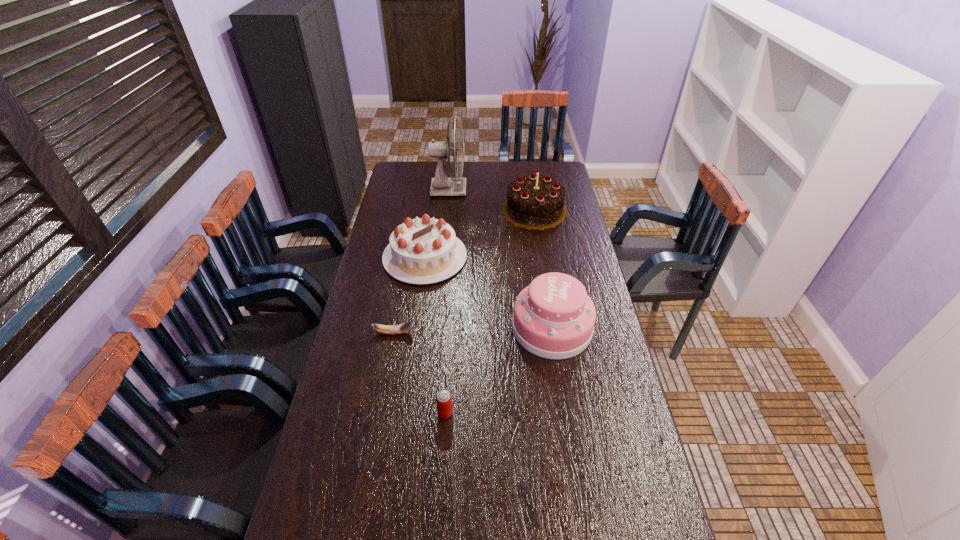
Find the location of `free space that is in between the shortest birthday cake and the farthest birthday cake`. free space that is in between the shortest birthday cake and the farthest birthday cake is located at coordinates (480, 234).

This screenshot has height=540, width=960. I want to click on vacant space in between the farthest birthday cake and the second nearest birthday cake, so click(x=480, y=234).

Locate an element on the screen. This screenshot has height=540, width=960. free space between the tallest object and the nearest object is located at coordinates (447, 301).

You are a GUI agent. You are given a task and a screenshot of the screen. Output one action in this format:
    pyautogui.click(x=<x>, y=<y>)
    Task: Click on the free space between the shortest birthday cake and the nearest birthday cake
    This screenshot has height=540, width=960.
    Given the screenshot: What is the action you would take?
    pyautogui.click(x=489, y=292)

Locate an element on the screen. Image resolution: width=960 pixels, height=540 pixels. free space between the farthest birthday cake and the beer can is located at coordinates (490, 312).

Locate an element on the screen. This screenshot has width=960, height=540. vacant area that lies between the farthest birthday cake and the nearest birthday cake is located at coordinates (543, 269).

You are a GUI agent. You are given a task and a screenshot of the screen. Output one action in this format:
    pyautogui.click(x=<x>, y=<y>)
    Task: Click on the empty space between the nearest birthday cake and the second nearest birthday cake
    The width and height of the screenshot is (960, 540).
    Given the screenshot: What is the action you would take?
    pyautogui.click(x=489, y=292)

What are the coordinates of `vacant area that lies between the fan and the nearest birthday cake` in the screenshot? It's located at (500, 259).

Identify which object is located as the second nearest to the banana. Please provide its 2D coordinates. Your answer should be formatted as a tuple, i.e. [(x, y)], where the tuple contains the x and y coordinates of a point satisfying the conditions above.

[(443, 399)]

Identify which object is the second nearest to the shortest birthday cake. Please provide its 2D coordinates. Your answer should be formatted as a tuple, i.e. [(x, y)], where the tuple contains the x and y coordinates of a point satisfying the conditions above.

[(553, 318)]